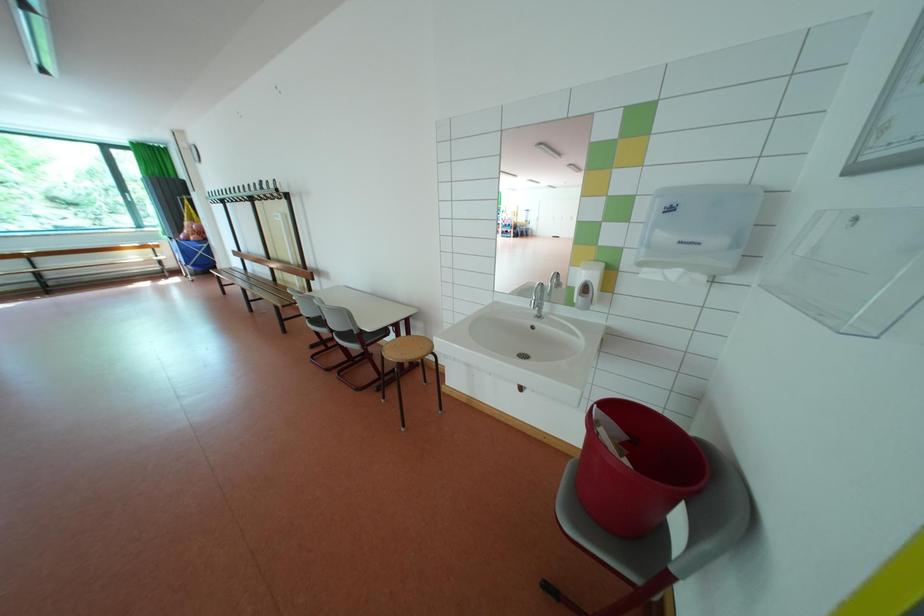
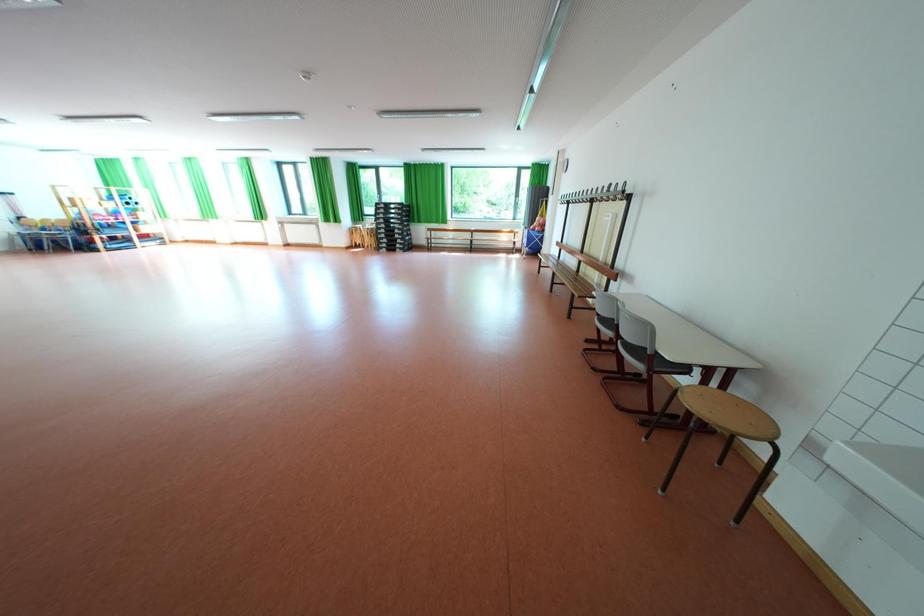
Question: Based on the continuous images, in which direction is the camera rotating? Reply with the corresponding letter.

Choices:
 (A) Left
 (B) Right
 (C) Up
 (D) Down

Answer: (A)